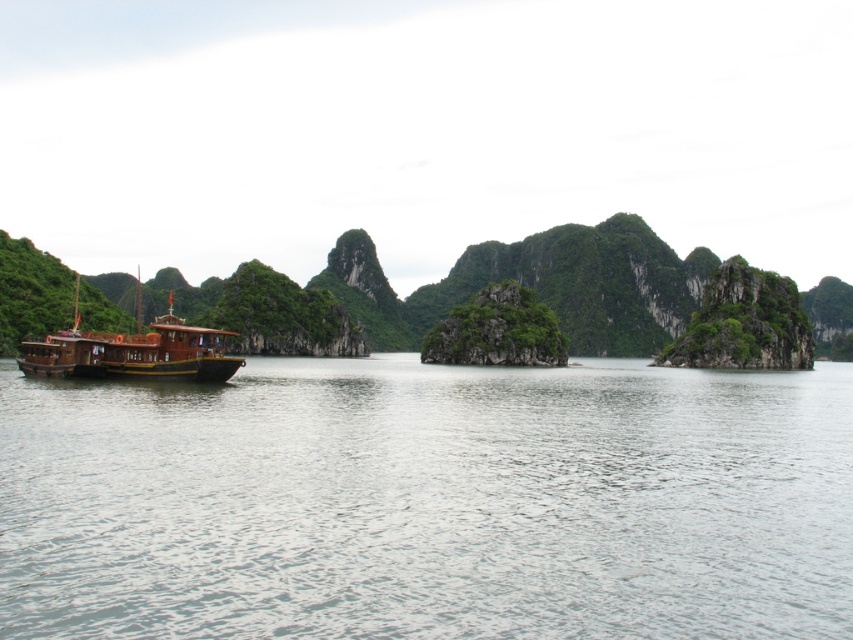
Question: Where is clear water at left located in relation to wooden boat at left in the image?

Choices:
 (A) below
 (B) above

Answer: (A)

Question: Does clear water at left have a larger size compared to wooden boat at left?

Choices:
 (A) yes
 (B) no

Answer: (B)

Question: Which object appears farthest from the camera in this image?

Choices:
 (A) wooden boat at left
 (B) clear water at left

Answer: (A)

Question: Which object appears farthest from the camera in this image?

Choices:
 (A) clear water at left
 (B) wooden boat at left

Answer: (B)

Question: Is clear water at left to the left of wooden boat at left from the viewer's perspective?

Choices:
 (A) yes
 (B) no

Answer: (B)

Question: Which point is closer to the camera?

Choices:
 (A) (57, 500)
 (B) (206, 372)

Answer: (A)